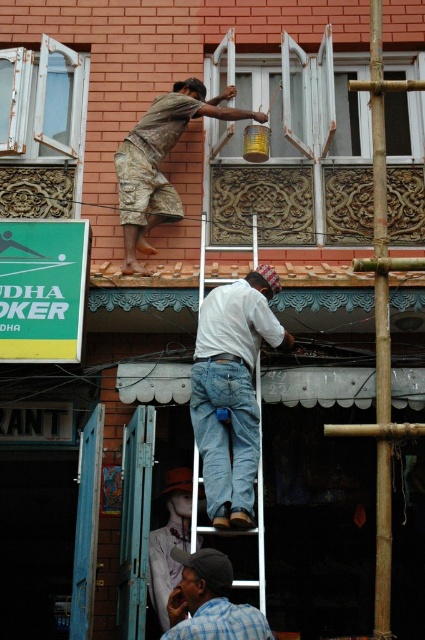
You are a construction worker standing at the entrance of the building. You need to locate the white cotton shirt at center and the checkered fabric cap at lower center. From your position, which object is positioned to the right?

The white cotton shirt at center is to the right of the checkered fabric cap at lower center, so the white cotton shirt at center is positioned to the right.

You are an observer looking at the construction scene. You notice two items in the image. One is camouflage shorts at upper center and the other is checkered fabric cap at lower center. Which of these two items is bigger in size?

The camouflage shorts at upper center is larger in size than the checkered fabric cap at lower center.